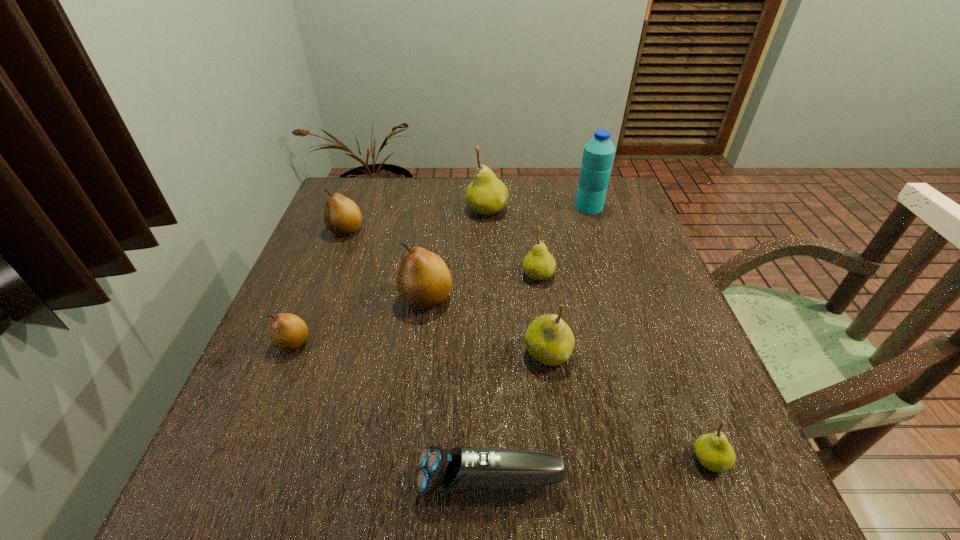
This screenshot has height=540, width=960. I want to click on vacant area between the rightmost green pear and the second smallest green pear, so click(x=624, y=367).

In order to click on free spot between the third biggest green pear and the rightmost green pear in this screenshot , I will do `click(624, 367)`.

What are the coordinates of `vacant area that lies between the second biggest brown pear and the second smallest green pear` in the screenshot? It's located at (442, 252).

In order to click on vacant area between the farthest brown pear and the nearest brown pear in this screenshot , I will do `click(320, 287)`.

Where is `vacant space that's between the water bottle and the nearest green pear`? vacant space that's between the water bottle and the nearest green pear is located at coordinates (649, 333).

Identify which object is the fifth closest to the third nearest green pear. Please provide its 2D coordinates. Your answer should be formatted as a tuple, i.e. [(x, y)], where the tuple contains the x and y coordinates of a point satisfying the conditions above.

[(462, 468)]

Identify which object is the closest to the farthest brown pear. Please provide its 2D coordinates. Your answer should be formatted as a tuple, i.e. [(x, y)], where the tuple contains the x and y coordinates of a point satisfying the conditions above.

[(423, 280)]

Image resolution: width=960 pixels, height=540 pixels. Identify the location of pear that is the fifth nearest to the farthest brown pear. (548, 338).

Select which pear appears as the third closest to the blue water bottle. Please provide its 2D coordinates. Your answer should be formatted as a tuple, i.e. [(x, y)], where the tuple contains the x and y coordinates of a point satisfying the conditions above.

[(423, 280)]

Identify which green pear is the second nearest to the electric shaver. Please provide its 2D coordinates. Your answer should be formatted as a tuple, i.e. [(x, y)], where the tuple contains the x and y coordinates of a point satisfying the conditions above.

[(714, 452)]